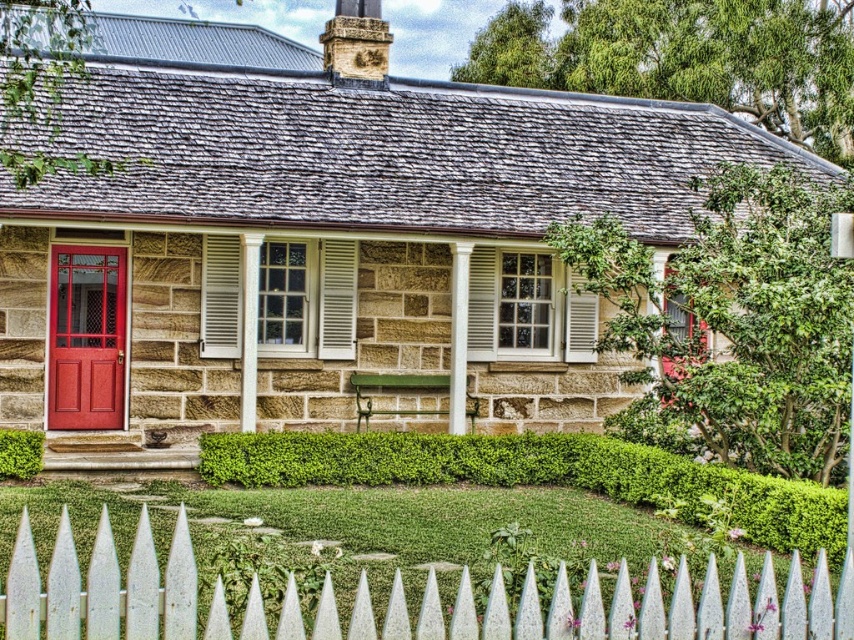
Can you confirm if stone cottage at center is positioned to the right of green leafy hedge at lower left?

Correct, you'll find stone cottage at center to the right of green leafy hedge at lower left.

Between stone cottage at center and green leafy hedge at lower left, which one has less height?

Standing shorter between the two is green leafy hedge at lower left.

Locate an element on the screen. The image size is (854, 640). stone cottage at center is located at coordinates (338, 230).

Between matte red door at left and white matte shutter at center, which one appears on the right side from the viewer's perspective?

From the viewer's perspective, white matte shutter at center appears more on the right side.

Does matte red door at left appear on the left side of white matte shutter at center?

Correct, you'll find matte red door at left to the left of white matte shutter at center.

Is point (115, 403) closer to viewer compared to point (566, 358)?

That is True.

This screenshot has height=640, width=854. In order to click on matte red door at left in this screenshot , I will do 86,337.

Can you confirm if green leafy hedge at right is positioned to the right of white wooden picket fence at lower center?

Indeed, green leafy hedge at right is positioned on the right side of white wooden picket fence at lower center.

Does green leafy hedge at right appear over white wooden picket fence at lower center?

Yes.

Locate an element on the screen. This screenshot has height=640, width=854. green leafy hedge at right is located at coordinates (733, 323).